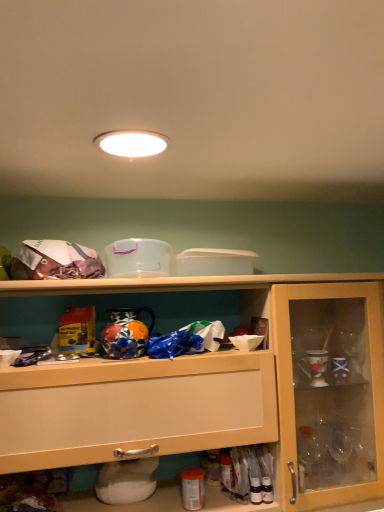
Question: From a real-world perspective, relative to white glossy light fixture at upper center, is wooden cabinet at center vertically above or below?

Choices:
 (A) above
 (B) below

Answer: (B)

Question: Considering their positions, is wooden cabinet at center located in front of or behind white glossy light fixture at upper center?

Choices:
 (A) front
 (B) behind

Answer: (B)

Question: In terms of width, does wooden cabinet at center look wider or thinner when compared to white glossy light fixture at upper center?

Choices:
 (A) wide
 (B) thin

Answer: (A)

Question: Would you say white glossy light fixture at upper center is inside or outside wooden cabinet at center?

Choices:
 (A) inside
 (B) outside

Answer: (B)

Question: Visually, is white glossy light fixture at upper center positioned to the left or to the right of wooden cabinet at center?

Choices:
 (A) right
 (B) left

Answer: (B)

Question: From a real-world perspective, is white glossy light fixture at upper center positioned above or below wooden cabinet at center?

Choices:
 (A) above
 (B) below

Answer: (A)

Question: Is point (112, 136) closer or farther from the camera than point (367, 317)?

Choices:
 (A) farther
 (B) closer

Answer: (B)